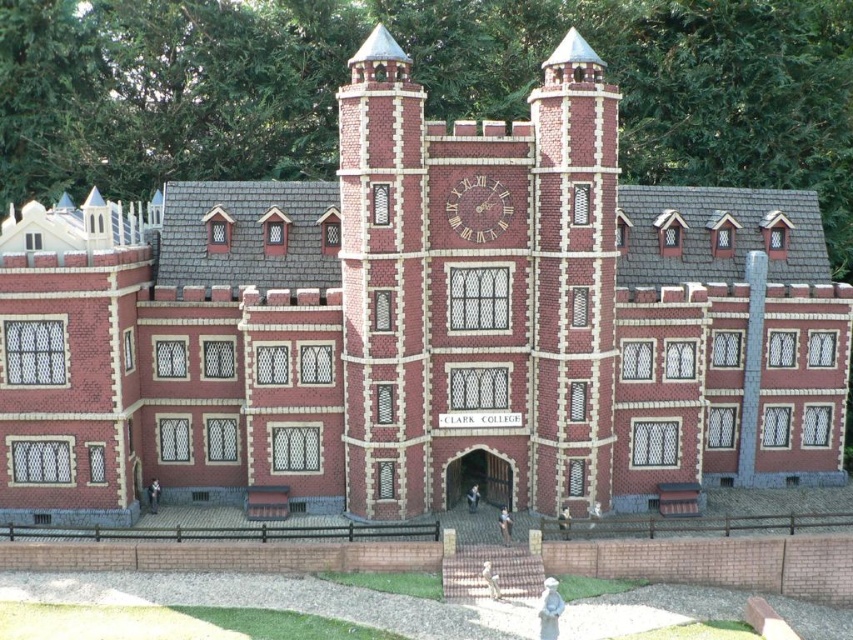
Question: Can you confirm if brick tower at center is bigger than matte red brick statue at center?

Choices:
 (A) no
 (B) yes

Answer: (B)

Question: Does brick tower at center lie behind matte brick statue at lower center?

Choices:
 (A) no
 (B) yes

Answer: (B)

Question: Based on their relative distances, which object is nearer to the brick tower at center?

Choices:
 (A) matte brick statue at lower center
 (B) matte red brick statue at center

Answer: (B)

Question: Is matte brick statue at lower center closer to the viewer compared to matte red brick statue at center?

Choices:
 (A) yes
 (B) no

Answer: (A)

Question: Which point is closer to the camera?

Choices:
 (A) (498, 522)
 (B) (495, 595)

Answer: (B)

Question: Which of the following is the farthest from the observer?

Choices:
 (A) brick tower at center
 (B) matte red brick statue at center

Answer: (B)